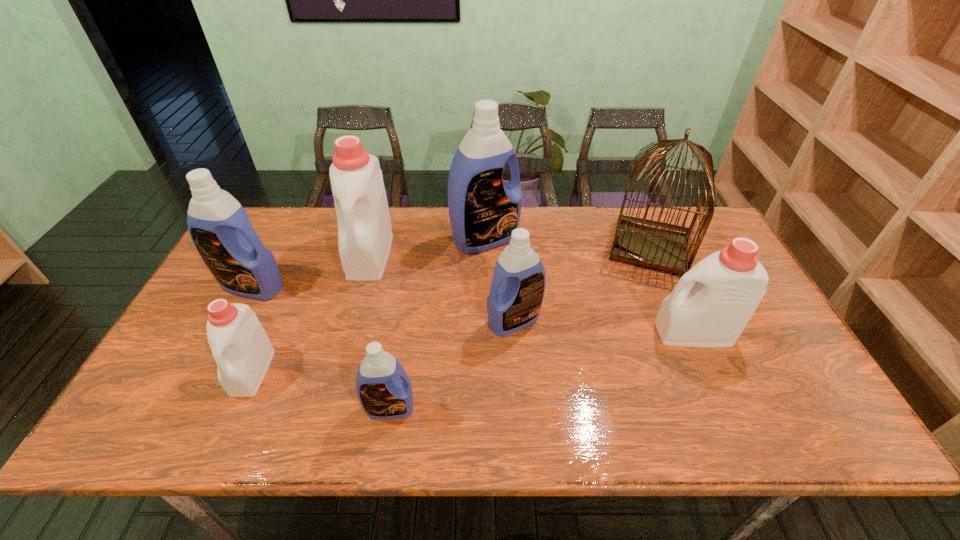
Identify which object is the closest to the birdcage. Please provide its 2D coordinates. Your answer should be formatted as a tuple, i.e. [(x, y)], where the tuple contains the x and y coordinates of a point satisfying the conditions above.

[(725, 288)]

Locate an element on the screen. detergent that can be found as the sixth closest to the second white detergent from left to right is located at coordinates click(725, 288).

Identify which detergent is the closest to the farthest blue detergent. Please provide its 2D coordinates. Your answer should be formatted as a tuple, i.e. [(x, y)], where the tuple contains the x and y coordinates of a point satisfying the conditions above.

[(364, 226)]

Where is `the closest blue detergent to the leftmost white detergent`? This screenshot has width=960, height=540. the closest blue detergent to the leftmost white detergent is located at coordinates (219, 226).

Select which blue detergent is the third closest to the birdcage. Please provide its 2D coordinates. Your answer should be formatted as a tuple, i.e. [(x, y)], where the tuple contains the x and y coordinates of a point satisfying the conditions above.

[(383, 394)]

Select which white detergent is the closest to the third biggest blue detergent. Please provide its 2D coordinates. Your answer should be formatted as a tuple, i.e. [(x, y)], where the tuple contains the x and y coordinates of a point satisfying the conditions above.

[(725, 288)]

Image resolution: width=960 pixels, height=540 pixels. I want to click on white detergent that stands as the second closest to the rightmost white detergent, so click(x=240, y=346).

Image resolution: width=960 pixels, height=540 pixels. Identify the location of free location that satisfies the following two spatial constraints: 1. on the front side of the leftmost blue detergent; 2. on the right side of the second nearest blue detergent. (235, 320).

Identify the location of free spot that satisfies the following two spatial constraints: 1. on the handle side of the leftmost white detergent; 2. on the right side of the nearest blue detergent. This screenshot has width=960, height=540. (236, 408).

Where is `vacant area that satisfies the following two spatial constraints: 1. on the handle side of the second biggest white detergent; 2. on the handle side of the smallest white detergent`? Image resolution: width=960 pixels, height=540 pixels. vacant area that satisfies the following two spatial constraints: 1. on the handle side of the second biggest white detergent; 2. on the handle side of the smallest white detergent is located at coordinates (711, 372).